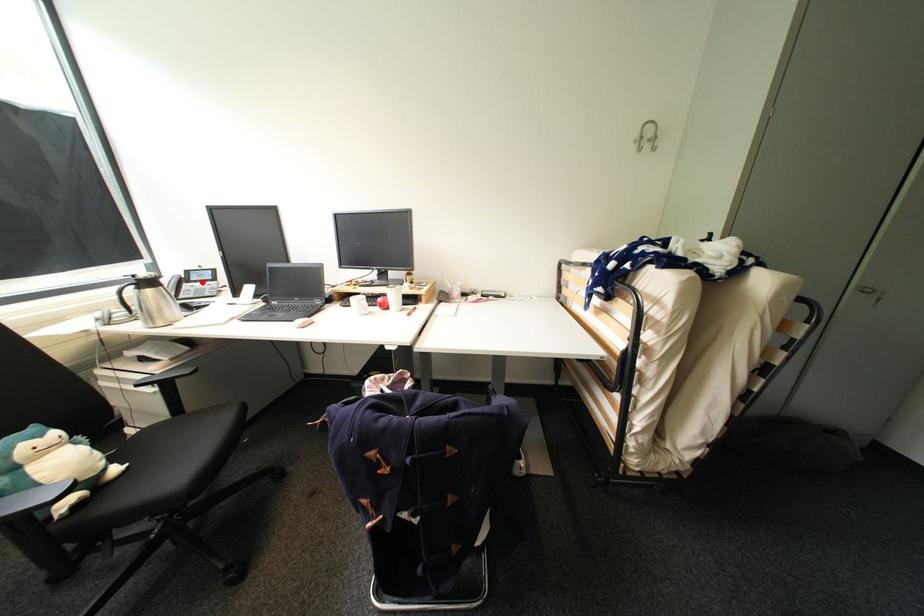
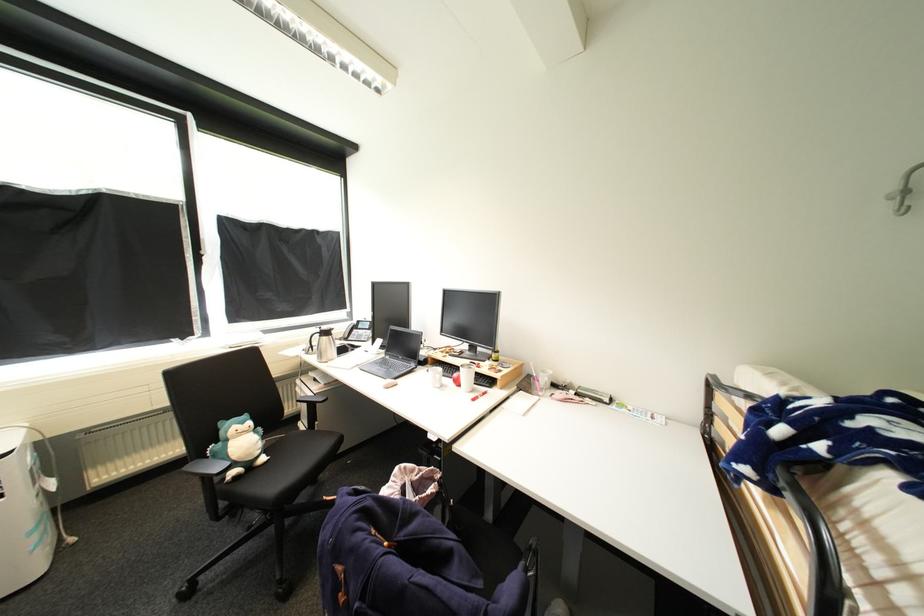
In the second image, find the point that corresponds to the highlighted location in the first image.

(367, 330)